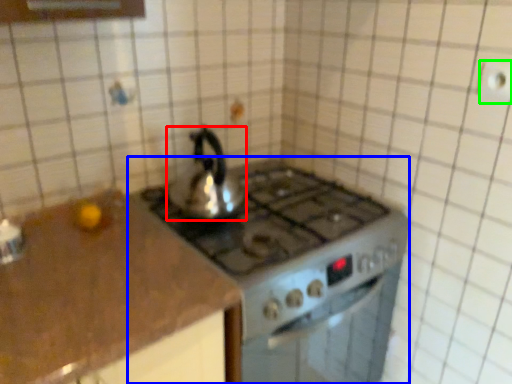
Question: Estimate the real-world distances between objects in this image. Which object is closer to kettle (highlighted by a red box), gas stove (highlighted by a blue box) or electric outlet (highlighted by a green box)?

Choices:
 (A) gas stove
 (B) electric outlet

Answer: (A)